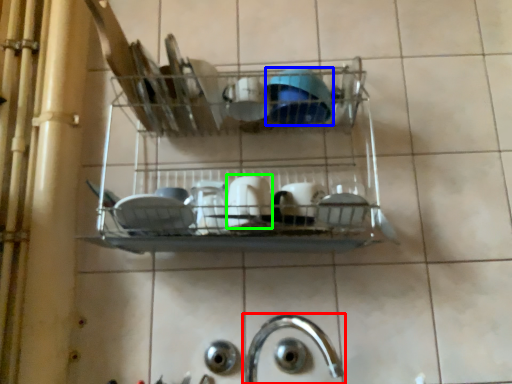
Question: Which is farther away from tap (highlighted by a red box)? tableware (highlighted by a blue box) or tableware (highlighted by a green box)?

Choices:
 (A) tableware
 (B) tableware

Answer: (A)